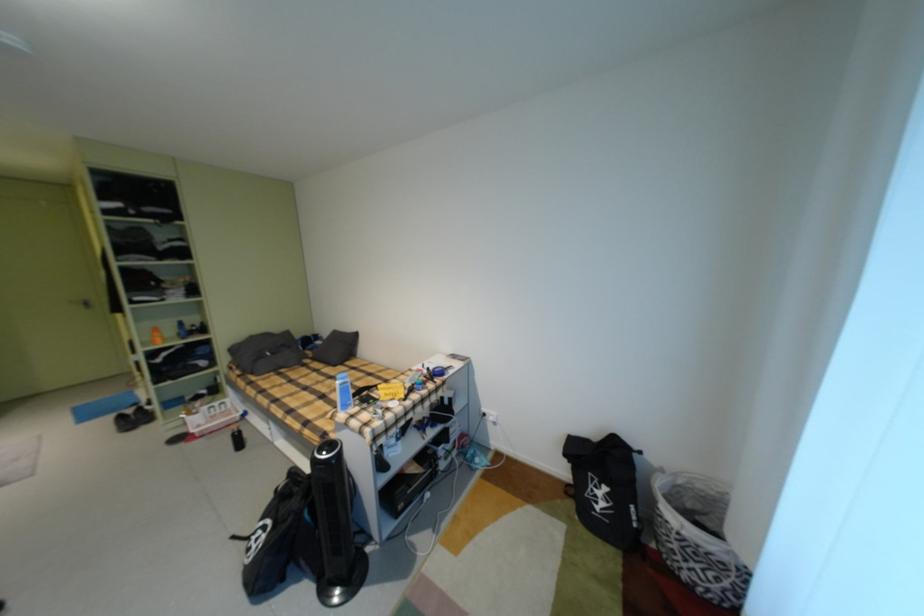
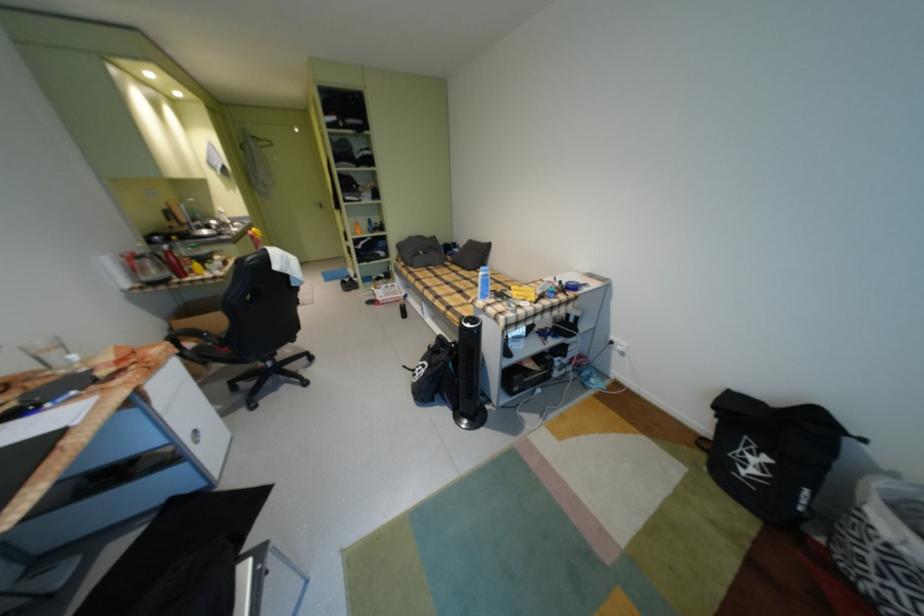
Find the pixel in the second image that matches the point at 605,512 in the first image.

(748, 474)